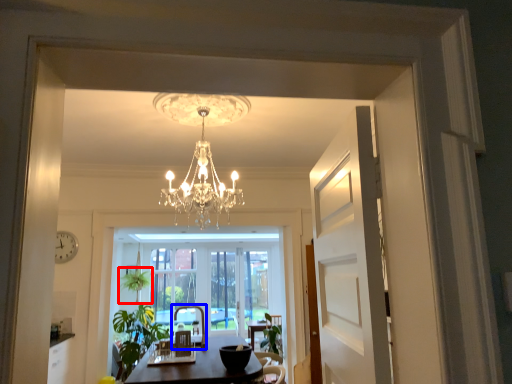
Question: Which point is closer to the camera, plant (highlighted by a red box) or armchair (highlighted by a blue box)?

Choices:
 (A) plant
 (B) armchair

Answer: (B)